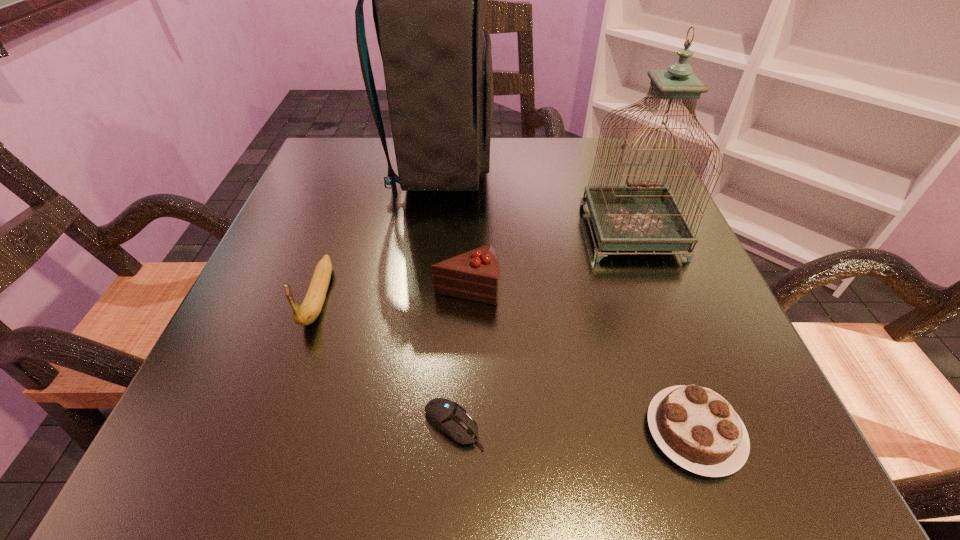
This screenshot has height=540, width=960. Find the location of `vacant space located at the door of the second tallest object`. vacant space located at the door of the second tallest object is located at coordinates (702, 416).

Locate an element on the screen. This screenshot has height=540, width=960. vacant area situated 0.100m at the stem of the leftmost object is located at coordinates (283, 400).

Where is `free spot located 0.150m on the front of the farther chocolate cake`? free spot located 0.150m on the front of the farther chocolate cake is located at coordinates (464, 393).

Locate an element on the screen. This screenshot has height=540, width=960. vacant space situated 0.180m on the left of the right chocolate cake is located at coordinates (498, 432).

Locate an element on the screen. This screenshot has height=540, width=960. free region located on the left of the shortest object is located at coordinates (211, 426).

Locate an element on the screen. The image size is (960, 540). object present at the far edge is located at coordinates (429, 0).

Find the location of a particular element. The image size is (960, 540). chocolate cake that is at the near edge is located at coordinates (698, 429).

Where is `computer mouse situated at the near edge`? computer mouse situated at the near edge is located at coordinates (445, 415).

Find the location of a particular element. This screenshot has height=540, width=960. object that is at the left edge is located at coordinates (307, 313).

This screenshot has width=960, height=540. Identify the location of birdcage that is at the right edge. (643, 216).